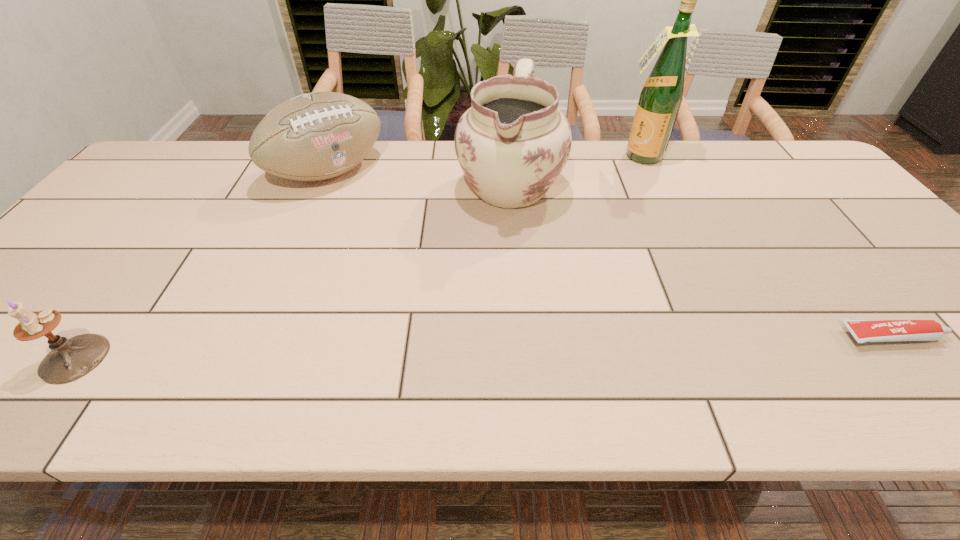
The width and height of the screenshot is (960, 540). I want to click on the second shortest object, so click(x=70, y=359).

Identify the location of candle holder. (70, 359).

Where is `the shortest object`? This screenshot has width=960, height=540. the shortest object is located at coordinates (864, 331).

You are a GUI agent. You are given a task and a screenshot of the screen. Output one action in this format:
    pyautogui.click(x=<x>, y=<y>)
    Task: Click on the toothpaste
    This screenshot has height=540, width=960.
    Given the screenshot: What is the action you would take?
    pyautogui.click(x=864, y=331)

This screenshot has width=960, height=540. In order to click on pitcher in this screenshot , I will do `click(513, 142)`.

This screenshot has width=960, height=540. I want to click on the fourth shortest object, so click(513, 142).

This screenshot has width=960, height=540. I want to click on the fourth object from left to right, so click(660, 99).

Where is `the tallest object`? This screenshot has width=960, height=540. the tallest object is located at coordinates (660, 99).

I want to click on the third shortest object, so click(x=315, y=136).

Image resolution: width=960 pixels, height=540 pixels. I want to click on football (American), so click(315, 136).